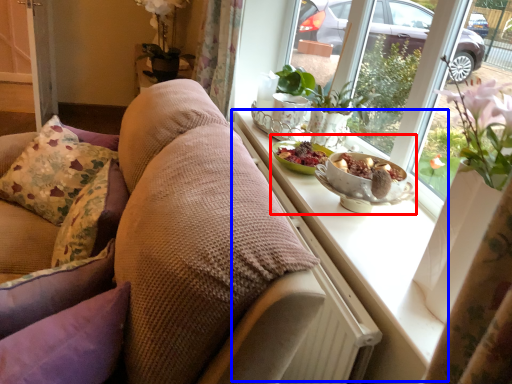
Question: Which point is closer to the camera, fruit dish (highlighted by a red box) or window sill (highlighted by a blue box)?

Choices:
 (A) fruit dish
 (B) window sill

Answer: (B)